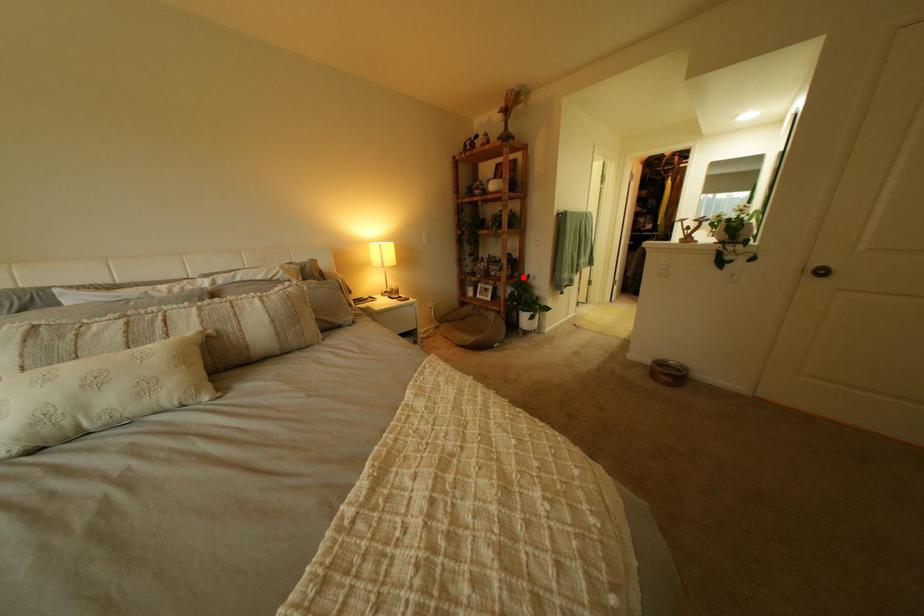
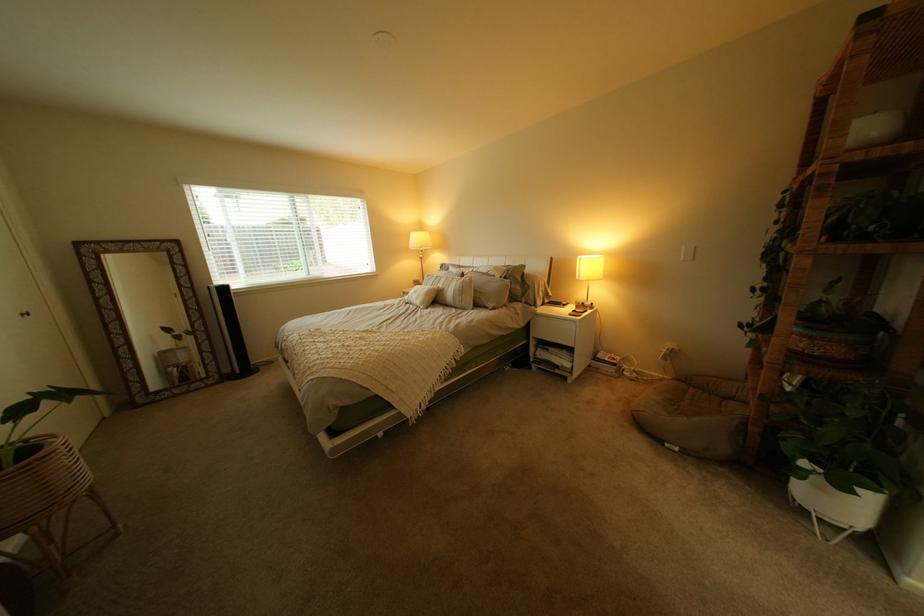
Question: I am providing you with two images of the same scene from different viewpoints. Image1 has a red point marked. In image2, the corresponding 3D location appears at what relative position? Reply with the corresponding letter.

Choices:
 (A) Closer
 (B) Farther

Answer: (B)